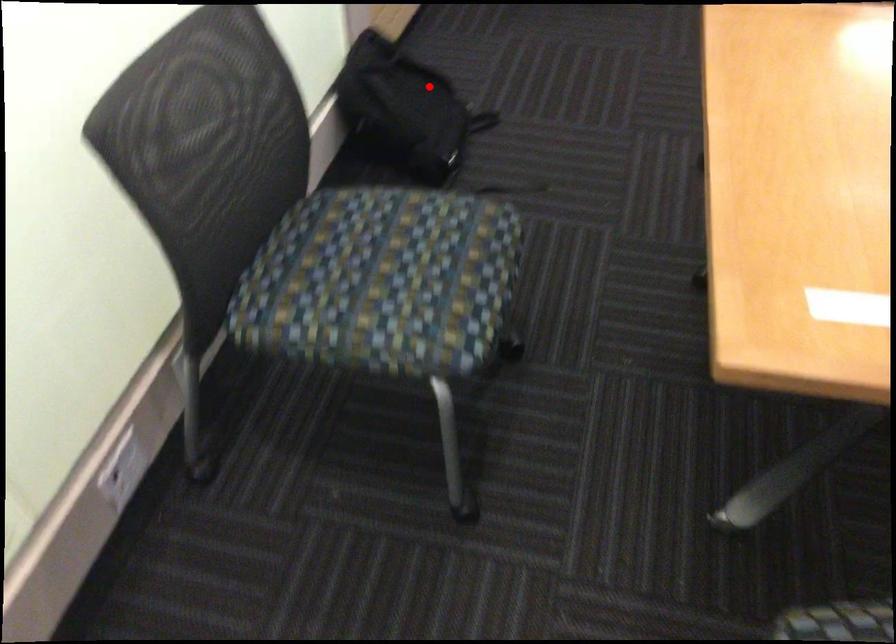
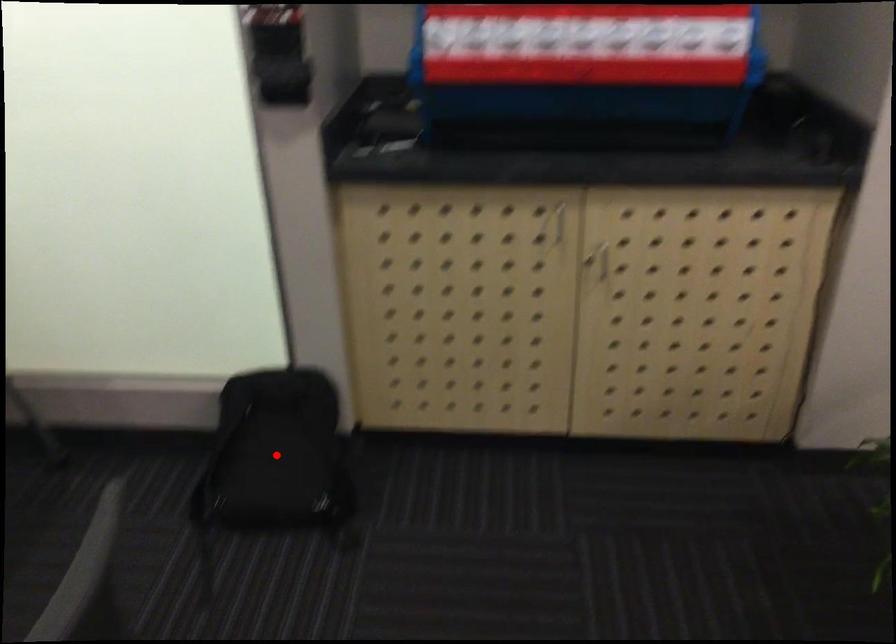
I am providing you with two images of the same scene from different viewpoints. A red point is marked on the first image and another point is marked on the second image. Does the point marked in image1 correspond to the same location as the one in image2?

Yes